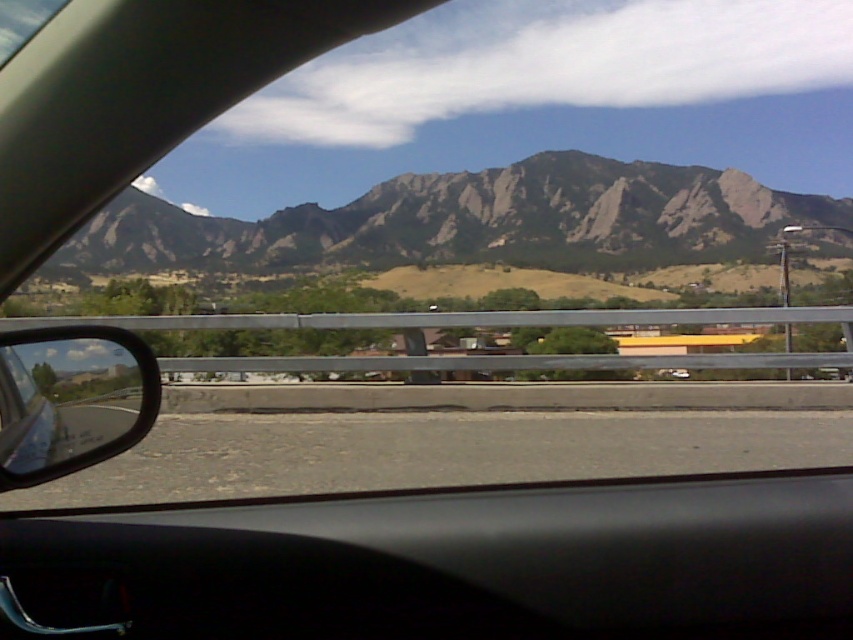
From the picture: You are a passenger in the car and want to check the black matte dashboard at center while the car is moving. Is the dashboard within a safe distance for you to reach without stretching too far?

The black matte dashboard at center is 1.49 meters from the camera, so it is within a safe distance for a passenger to comfortably reach without stretching too far.

You are sitting in the driver seat of the vehicle and want to place a 1.5 meter long ladder between the two points marked as point (x=659, y=588). Will the ladder fit between them?

The two points marked as point (x=659, y=588) are 1.61 meters apart, so the 1.5 meter long ladder will fit between them since it is shorter than the distance between the points.

You are sitting in the driver seat of the car and want to know which of the two points, point (x=229, y=630) or point (x=123, y=368), is closer to you. According to the image, which point is closer?

Point (x=229, y=630) is closer to the camera than point (x=123, y=368), so it is closer to you.